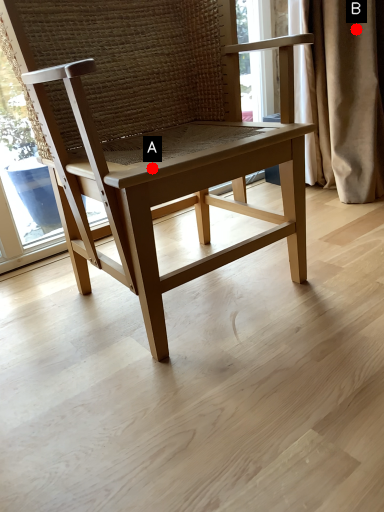
Question: Two points are circled on the image, labeled by A and B beside each circle. Which point is farther to the camera?

Choices:
 (A) A is further
 (B) B is further

Answer: (B)